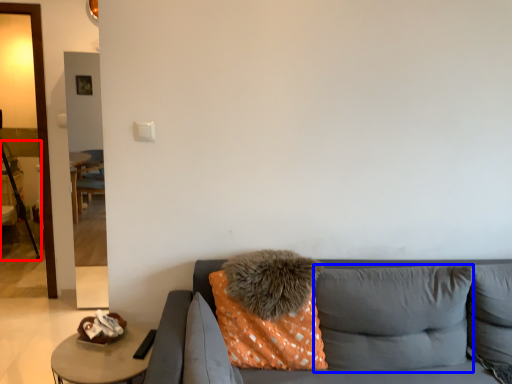
Question: Which of the following is the closest to the observer, tripod (highlighted by a red box) or pillow (highlighted by a blue box)?

Choices:
 (A) tripod
 (B) pillow

Answer: (B)